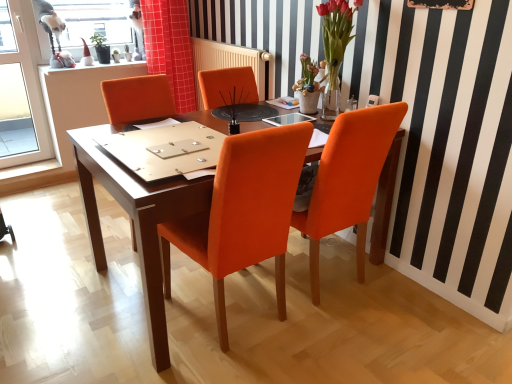
Locate an element on the screen. free spot to the right of orange leather chair at center, which is the 1th chair from right to left is located at coordinates (412, 300).